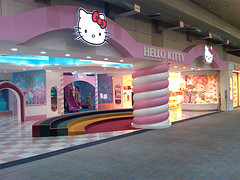
Help me find where you would sit in the image by pointing to them. Your answer should be formatted as a list of tuples, i.e. [(x1, y1), (x2, y2), ...], where each tuple contains the x and y coordinates of a point satisfying the conditions above.

[(47, 123), (60, 122), (77, 125)]